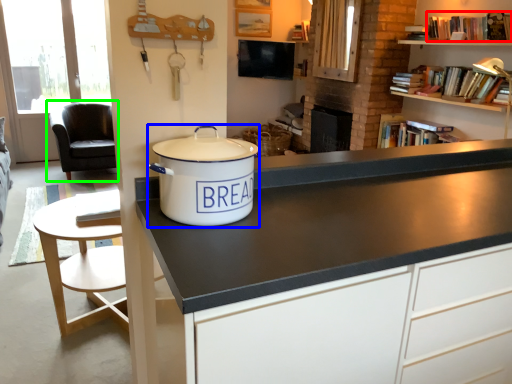
Question: Estimate the real-world distances between objects in this image. Which object is farther from book (highlighted by a red box), cooker (highlighted by a blue box) or chair (highlighted by a green box)?

Choices:
 (A) cooker
 (B) chair

Answer: (B)